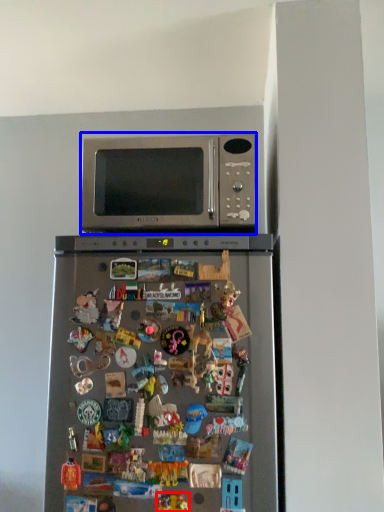
Question: Which of the following is the farthest to the observer, toy (highlighted by a red box) or microwave oven (highlighted by a blue box)?

Choices:
 (A) toy
 (B) microwave oven

Answer: (B)